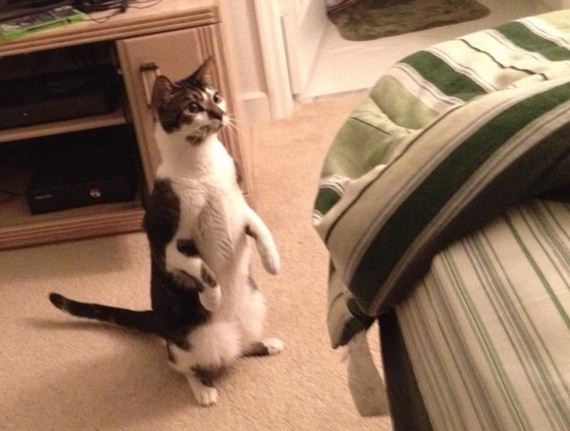
Where is `rug`? rug is located at coordinates (370, 27).